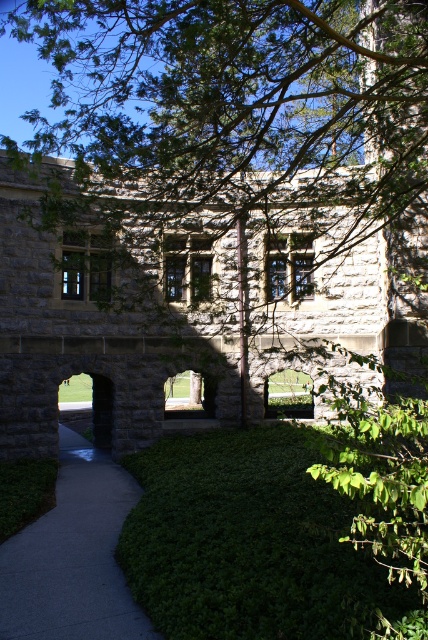
You are a gardener with a 1.5 meter wide lawnmower. You need to mow the area between the green leafy bush at lower center and the gray concrete sidewalk at lower left. Can your lawnmower fit through the space between them?

The distance between the green leafy bush at lower center and the gray concrete sidewalk at lower left is 1.22 meters. Since the lawnmower is 1.5 meters wide, it cannot fit through the space between them.

You are standing on the paved walkway and want to take a photo of the stone building. There are two points marked on your map at coordinates point (x=181, y=513) and point (x=110, y=605). Which point should you move towards to get a better view of the building without any obstruction?

You should move towards point (x=181, y=513) because it is closer to you compared to point (x=110, y=605), which is further away. Being closer allows for a clearer, less obstructed view of the stone building.

You are a gardener who needs to water the green leafy bush at lower center and the gray concrete sidewalk at lower left. Which object should you water first if you start from the entrance of the pathway?

You should water the gray concrete sidewalk at lower left first because it is on the left side of the green leafy bush at lower center, so it comes before the bush when moving along the pathway from the entrance.